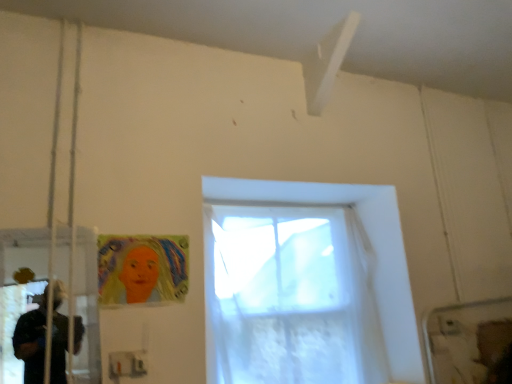
Question: From a real-world perspective, is pastel crayon drawing of a woman at lower left located higher than translucent white curtain at center?

Choices:
 (A) no
 (B) yes

Answer: (B)

Question: Is pastel crayon drawing of a woman at lower left bigger than translucent white curtain at center?

Choices:
 (A) no
 (B) yes

Answer: (A)

Question: Is pastel crayon drawing of a woman at lower left positioned with its back to translucent white curtain at center?

Choices:
 (A) no
 (B) yes

Answer: (A)

Question: Is pastel crayon drawing of a woman at lower left smaller than translucent white curtain at center?

Choices:
 (A) no
 (B) yes

Answer: (B)

Question: Is translucent white curtain at center inside pastel crayon drawing of a woman at lower left?

Choices:
 (A) yes
 (B) no

Answer: (B)

Question: Is point (418, 360) closer or farther from the camera than point (118, 269)?

Choices:
 (A) closer
 (B) farther

Answer: (B)

Question: In terms of height, does translucent white curtain at center look taller or shorter compared to pastel crayon drawing of a woman at lower left?

Choices:
 (A) tall
 (B) short

Answer: (A)

Question: Is translucent white curtain at center inside the boundaries of pastel crayon drawing of a woman at lower left, or outside?

Choices:
 (A) outside
 (B) inside

Answer: (A)

Question: Considering the positions of translucent white curtain at center and pastel crayon drawing of a woman at lower left in the image, is translucent white curtain at center wider or thinner than pastel crayon drawing of a woman at lower left?

Choices:
 (A) thin
 (B) wide

Answer: (B)

Question: Is point (117, 274) closer or farther from the camera than point (94, 266)?

Choices:
 (A) closer
 (B) farther

Answer: (B)

Question: Do you think pastel crayon drawing of a woman at lower left is within transparent plastic screen door at left, or outside of it?

Choices:
 (A) outside
 (B) inside

Answer: (A)

Question: In the image, is pastel crayon drawing of a woman at lower left positioned in front of or behind transparent plastic screen door at left?

Choices:
 (A) behind
 (B) front

Answer: (A)

Question: Considering the positions of pastel crayon drawing of a woman at lower left and transparent plastic screen door at left in the image, is pastel crayon drawing of a woman at lower left taller or shorter than transparent plastic screen door at left?

Choices:
 (A) short
 (B) tall

Answer: (A)

Question: From the image's perspective, relative to translucent white curtain at center, is pastel crayon drawing of a woman at lower left above or below?

Choices:
 (A) below
 (B) above

Answer: (B)

Question: Is pastel crayon drawing of a woman at lower left in front of or behind translucent white curtain at center in the image?

Choices:
 (A) behind
 (B) front

Answer: (B)